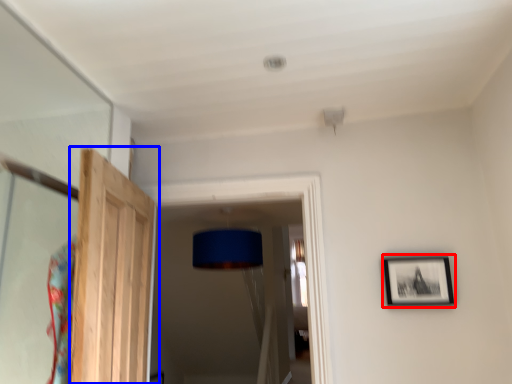
Question: Which point is further to the camera, picture frame (highlighted by a red box) or door (highlighted by a blue box)?

Choices:
 (A) picture frame
 (B) door

Answer: (A)